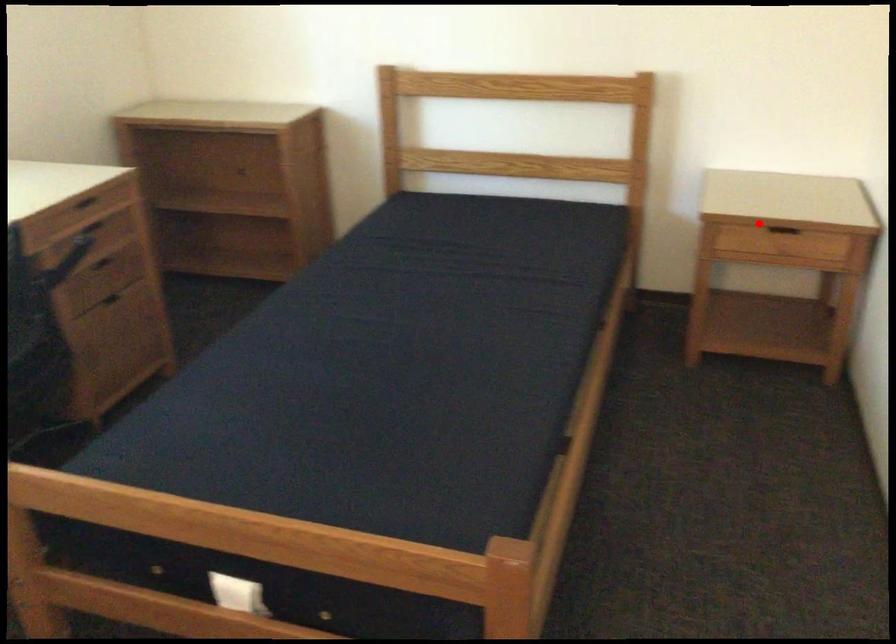
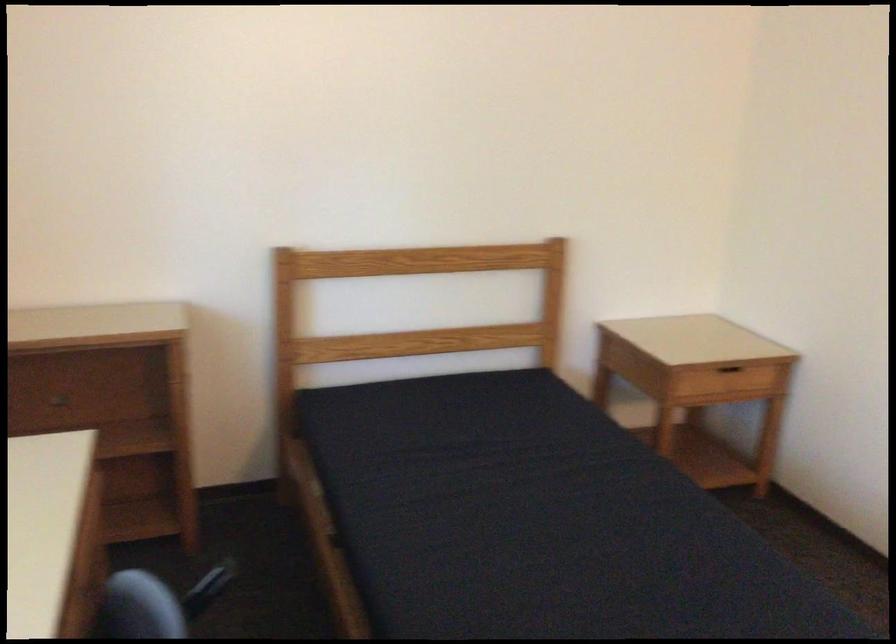
The point at the highlighted location is marked in the first image. Where is the corresponding point in the second image?

(727, 368)